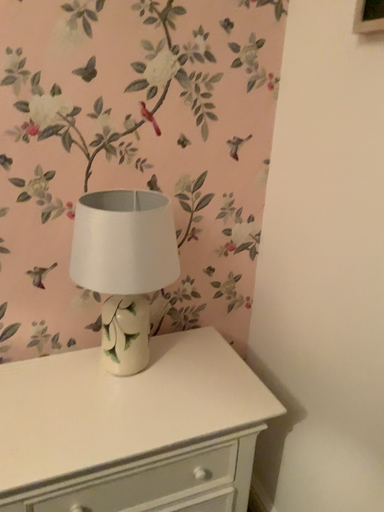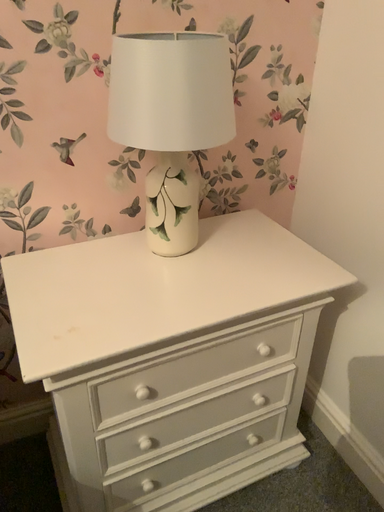
Question: How did the camera likely rotate when shooting the video?

Choices:
 (A) rotated upward
 (B) rotated downward

Answer: (B)